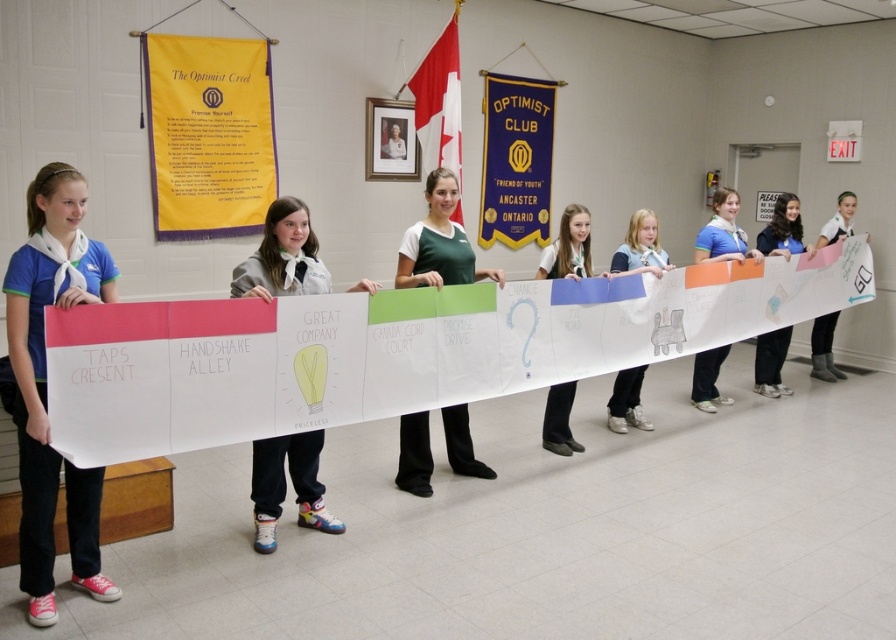
You are standing in front of the banner held by the group. You notice two points on the banner marked as point (216, 116) and point (567, 266). Which point is closer to you?

Point (216, 116) is further to the camera than point (567, 266), so the point closer to you is point (567, 266).